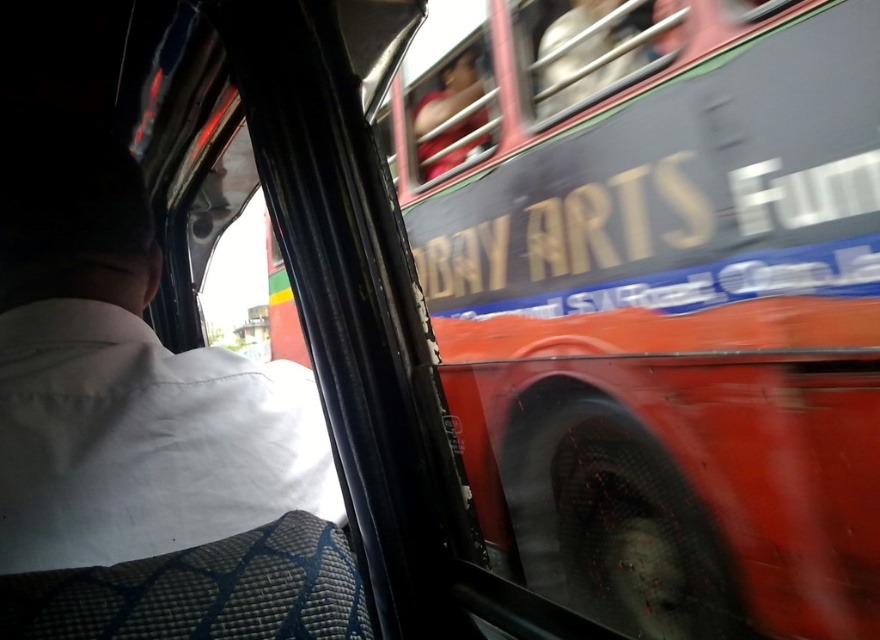
Question: Does white fabric shirt at left have a lesser width compared to metallic red bus window at upper center?

Choices:
 (A) no
 (B) yes

Answer: (B)

Question: Which point is farther to the camera?

Choices:
 (A) (385, 134)
 (B) (875, 232)
 (C) (71, 474)

Answer: (A)

Question: From the image, what is the correct spatial relationship of red matte bus at upper right in relation to white fabric shirt at left?

Choices:
 (A) right
 (B) left

Answer: (A)

Question: Which object is the closest to the red matte bus at upper right?

Choices:
 (A) metallic red bus window at upper center
 (B) white fabric shirt at left

Answer: (A)

Question: Which is farther from the red matte bus at upper right?

Choices:
 (A) metallic red bus window at upper center
 (B) white fabric shirt at left

Answer: (B)

Question: From the image, what is the correct spatial relationship of red matte bus at upper right in relation to white fabric shirt at left?

Choices:
 (A) above
 (B) below

Answer: (A)